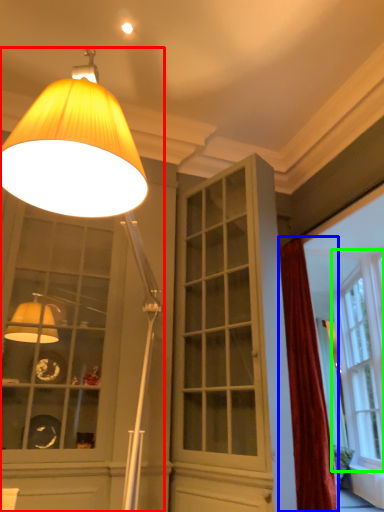
Question: Estimate the real-world distances between objects in this image. Which object is farther from lamp (highlighted by a red box), curtain (highlighted by a blue box) or window (highlighted by a green box)?

Choices:
 (A) curtain
 (B) window

Answer: (B)